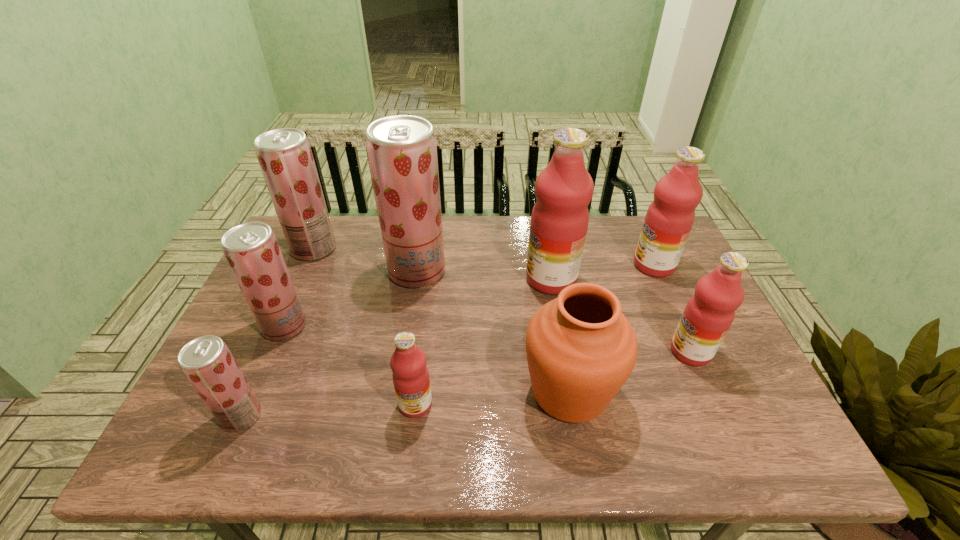
The width and height of the screenshot is (960, 540). What are the coordinates of `object that is positioned at the far right corner` in the screenshot? It's located at (669, 219).

I want to click on vacant space at the far edge of the desktop, so click(x=516, y=239).

At what (x,y) coordinates should I click in order to perform the action: click on vacant space at the near edge. Please return your answer as a coordinate pair (x, y). This screenshot has height=540, width=960. Looking at the image, I should click on (303, 426).

In order to click on free space at the right edge of the desktop in this screenshot , I will do `click(655, 305)`.

I want to click on vacant area at the far left corner of the desktop, so click(285, 239).

In the image, there is a desktop. At what (x,y) coordinates should I click in order to perform the action: click on vacant space at the far right corner. Please return your answer as a coordinate pair (x, y). This screenshot has height=540, width=960. Looking at the image, I should click on (629, 219).

The height and width of the screenshot is (540, 960). Identify the location of vacant space in between the second nearest strawberry fruit juice and the third smallest pink fruit juice. (469, 295).

The image size is (960, 540). In order to click on free space between the third biggest strawberry fruit juice and the sixth fruit juice from left to right in this screenshot , I will do `click(418, 302)`.

At what (x,y) coordinates should I click in order to perform the action: click on free space between the brown urn and the third farthest strawberry fruit juice. Please return your answer as a coordinate pair (x, y). Image resolution: width=960 pixels, height=540 pixels. Looking at the image, I should click on (427, 359).

Identify the location of vacant area that lies between the brown urn and the second nearest strawberry fruit juice. (427, 359).